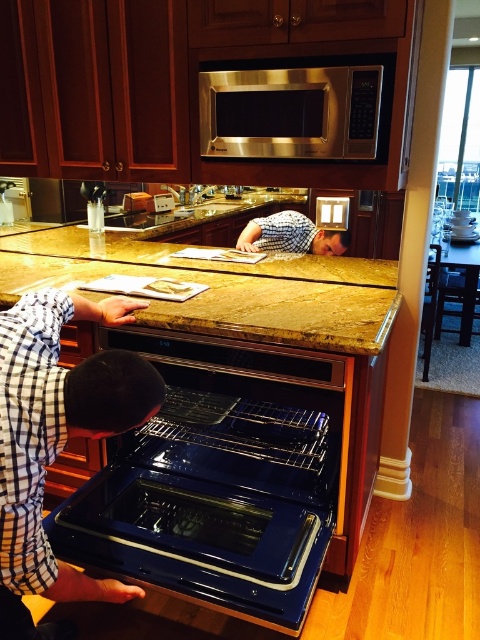
Can you confirm if brown polished granite counter at center is positioned below satin stainless steel microwave at upper center?

Yes.

You are a GUI agent. You are given a task and a screenshot of the screen. Output one action in this format:
    pyautogui.click(x=<x>, y=<y>)
    Task: Click on the brown polished granite counter at center
    
    Given the screenshot: What is the action you would take?
    pos(220,289)

Between shiny black oven at center and satin stainless steel microwave at upper center, which one appears on the right side from the viewer's perspective?

Positioned to the right is satin stainless steel microwave at upper center.

This screenshot has height=640, width=480. Describe the element at coordinates (218, 481) in the screenshot. I see `shiny black oven at center` at that location.

What do you see at coordinates (218, 481) in the screenshot?
I see `shiny black oven at center` at bounding box center [218, 481].

Locate an element on the screen. The height and width of the screenshot is (640, 480). shiny black oven at center is located at coordinates (218, 481).

Does shiny black oven at center lie in front of checkered fabric shirt at center?

Yes.

This screenshot has width=480, height=640. What are the coordinates of `shiny black oven at center` in the screenshot? It's located at (218, 481).